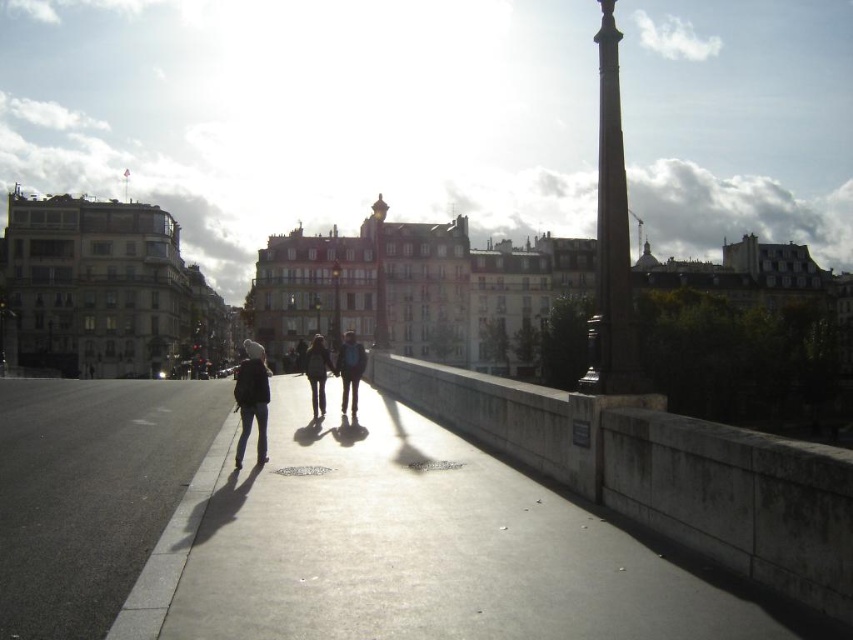
Question: Can you confirm if polished stone column at right is smaller than dark gray knit hat at center?

Choices:
 (A) no
 (B) yes

Answer: (A)

Question: Is gray concrete pavement at center smaller than gray concrete pavement at lower left?

Choices:
 (A) yes
 (B) no

Answer: (B)

Question: Can you confirm if gray concrete pavement at center is positioned to the left of matte black clothing at center?

Choices:
 (A) no
 (B) yes

Answer: (A)

Question: Among these objects, which one is nearest to the camera?

Choices:
 (A) polished stone column at right
 (B) dark gray jeans at center
 (C) matte black jacket at center

Answer: (A)

Question: Estimate the real-world distances between objects in this image. Which object is farther from the gray concrete pavement at lower left?

Choices:
 (A) matte black clothing at center
 (B) polished stone column at right
 (C) gray concrete pavement at center

Answer: (B)

Question: Which object is positioned closest to the matte black jacket at center?

Choices:
 (A) dark gray jeans at center
 (B) gray concrete pavement at center
 (C) polished stone column at right

Answer: (A)